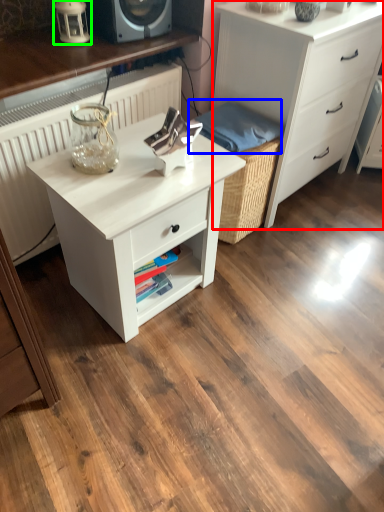
Question: Based on their relative distances, which object is nearer to chest of drawers (highlighted by a red box)? Choose from material (highlighted by a blue box) and table lamp (highlighted by a green box).

Choices:
 (A) material
 (B) table lamp

Answer: (A)